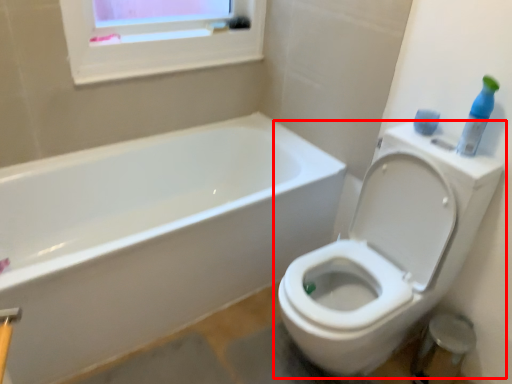
Question: In this image, where is toilet (annotated by the red box) located relative to cleaning product?

Choices:
 (A) left
 (B) right

Answer: (A)